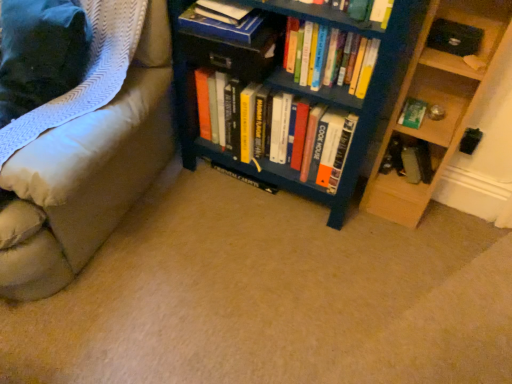
Where is `free space in front of blue painted wood bookcase at center`? free space in front of blue painted wood bookcase at center is located at coordinates (282, 273).